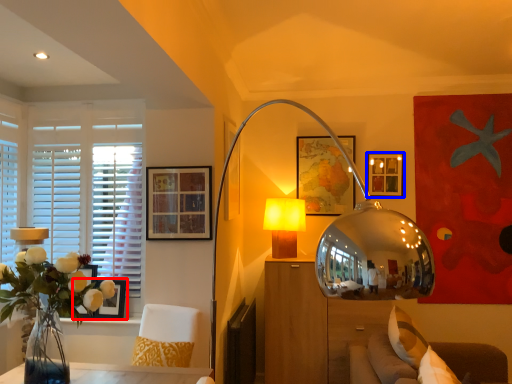
Question: Which of the following is the farthest to the observer, picture frame (highlighted by a red box) or picture frame (highlighted by a blue box)?

Choices:
 (A) picture frame
 (B) picture frame

Answer: (B)